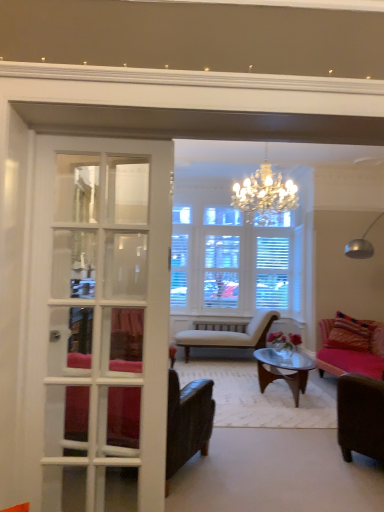
At what (x,y) coordinates should I click in order to perform the action: click on beige striped chaise lounge at center, which ranks as the first chair in back-to-front order. Please return your answer as a coordinate pair (x, y). The height and width of the screenshot is (512, 384). Looking at the image, I should click on (229, 335).

This screenshot has width=384, height=512. I want to click on leather armchair at left, the 3th chair viewed from the back, so click(x=187, y=421).

You are a GUI agent. You are given a task and a screenshot of the screen. Output one action in this format:
    pyautogui.click(x=<x>, y=<y>)
    Task: Click on the brown leather chair at lower right, which is counted as the second chair, starting from the back
    Image resolution: width=384 pixels, height=512 pixels.
    Given the screenshot: What is the action you would take?
    pyautogui.click(x=360, y=416)

What do you see at coordinates (101, 304) in the screenshot? I see `white glass door at left` at bounding box center [101, 304].

Locate an element on the screen. The width and height of the screenshot is (384, 512). beige striped chaise lounge at center, which ranks as the first chair in back-to-front order is located at coordinates (229, 335).

Can you see leather armchair at left, the 3th chair viewed from the back, touching beige striped chaise lounge at center, placed as the 3th chair when sorted from front to back?

There is a gap between leather armchair at left, the 3th chair viewed from the back, and beige striped chaise lounge at center, placed as the 3th chair when sorted from front to back.

Considering the positions of point (129, 440) and point (242, 343), is point (129, 440) closer or farther from the camera than point (242, 343)?

Point (129, 440) is positioned closer to the camera compared to point (242, 343).

How different are the orientations of leather armchair at left, the first chair in the front-to-back sequence, and beige striped chaise lounge at center, placed as the 3th chair when sorted from front to back, in degrees?

The facing directions of leather armchair at left, the first chair in the front-to-back sequence, and beige striped chaise lounge at center, placed as the 3th chair when sorted from front to back, are 152 degrees apart.

Based on the photo, do you think leather armchair at left, the 3th chair viewed from the back, is within beige striped chaise lounge at center, placed as the 3th chair when sorted from front to back, or outside of it?

leather armchair at left, the 3th chair viewed from the back, exists outside the volume of beige striped chaise lounge at center, placed as the 3th chair when sorted from front to back.

In the scene shown: From the image's perspective, is beige striped chaise lounge at center, placed as the 3th chair when sorted from front to back, located above leather armchair at left, the first chair in the front-to-back sequence?

No, from the image's perspective, beige striped chaise lounge at center, placed as the 3th chair when sorted from front to back, is not over leather armchair at left, the first chair in the front-to-back sequence.

Between point (200, 335) and point (183, 393), which one is positioned in front?

The point (183, 393) is closer.

Considering the relative positions of beige striped chaise lounge at center, placed as the 3th chair when sorted from front to back, and leather armchair at left, the first chair in the front-to-back sequence, in the image provided, is beige striped chaise lounge at center, placed as the 3th chair when sorted from front to back, behind leather armchair at left, the first chair in the front-to-back sequence,?

Yes, beige striped chaise lounge at center, placed as the 3th chair when sorted from front to back, is further from the viewer.

Looking at this image, does beige striped chaise lounge at center, which ranks as the first chair in back-to-front order, turn towards leather armchair at left, the 3th chair viewed from the back?

Yes, beige striped chaise lounge at center, which ranks as the first chair in back-to-front order, faces towards leather armchair at left, the 3th chair viewed from the back.

Which is in front, point (69, 362) or point (214, 335)?

The point (69, 362) is closer.

Which is more to the left, white glass door at left or beige striped chaise lounge at center, placed as the 3th chair when sorted from front to back?

From the viewer's perspective, white glass door at left appears more on the left side.

From a real-world perspective, relative to beige striped chaise lounge at center, which ranks as the first chair in back-to-front order, is white glass door at left vertically above or below?

white glass door at left is above beige striped chaise lounge at center, which ranks as the first chair in back-to-front order.

Can beige striped chaise lounge at center, placed as the 3th chair when sorted from front to back, be found inside white glass door at left?

That's incorrect, beige striped chaise lounge at center, placed as the 3th chair when sorted from front to back, is not inside white glass door at left.

Considering the relative positions of beige striped chaise lounge at center, placed as the 3th chair when sorted from front to back, and brown leather chair at lower right, marked as the second chair in a front-to-back arrangement, in the image provided, is beige striped chaise lounge at center, placed as the 3th chair when sorted from front to back, to the right of brown leather chair at lower right, marked as the second chair in a front-to-back arrangement, from the viewer's perspective?

In fact, beige striped chaise lounge at center, placed as the 3th chair when sorted from front to back, is to the left of brown leather chair at lower right, marked as the second chair in a front-to-back arrangement.

From the image's perspective, which object appears higher, beige striped chaise lounge at center, placed as the 3th chair when sorted from front to back, or brown leather chair at lower right, marked as the second chair in a front-to-back arrangement?

brown leather chair at lower right, marked as the second chair in a front-to-back arrangement, from the image's perspective.

Can you confirm if beige striped chaise lounge at center, which ranks as the first chair in back-to-front order, is smaller than brown leather chair at lower right, which is counted as the second chair, starting from the back?

No.

How many degrees apart are the facing directions of beige striped chaise lounge at center, which ranks as the first chair in back-to-front order, and brown leather chair at lower right, which is counted as the second chair, starting from the back?

179 degrees separate the facing orientations of beige striped chaise lounge at center, which ranks as the first chair in back-to-front order, and brown leather chair at lower right, which is counted as the second chair, starting from the back.

Consider the image. Considering the sizes of objects leather armchair at left, the first chair in the front-to-back sequence, and white glass door at left in the image provided, who is bigger, leather armchair at left, the first chair in the front-to-back sequence, or white glass door at left?

Bigger between the two is leather armchair at left, the first chair in the front-to-back sequence.

Can we say leather armchair at left, the 3th chair viewed from the back, lies outside white glass door at left?

Yes, leather armchair at left, the 3th chair viewed from the back, is not within white glass door at left.

Who is taller, leather armchair at left, the 3th chair viewed from the back, or white glass door at left?

Standing taller between the two is white glass door at left.

How far apart are brown leather chair at lower right, which is counted as the second chair, starting from the back, and white glass door at left?

The distance of brown leather chair at lower right, which is counted as the second chair, starting from the back, from white glass door at left is 5.86 feet.

You are a GUI agent. You are given a task and a screenshot of the screen. Output one action in this format:
    pyautogui.click(x=<x>, y=<y>)
    Task: Click on the 2nd chair to the right when counting from the white glass door at left
    
    Given the screenshot: What is the action you would take?
    click(360, 416)

Which object is further away from the camera taking this photo, brown leather chair at lower right, marked as the second chair in a front-to-back arrangement, or white glass door at left?

brown leather chair at lower right, marked as the second chair in a front-to-back arrangement, is further from the camera.

Which of these two, white glass door at left or leather armchair at left, the first chair in the front-to-back sequence, stands shorter?

leather armchair at left, the first chair in the front-to-back sequence.

Between point (83, 313) and point (75, 419), which one is positioned behind?

Positioned behind is point (83, 313).

Looking at this image, is white glass door at left directly adjacent to leather armchair at left, the 3th chair viewed from the back?

white glass door at left and leather armchair at left, the 3th chair viewed from the back, are clearly separated.

Can you confirm if white glass door at left is wider than leather armchair at left, the 3th chair viewed from the back?

Incorrect, the width of white glass door at left does not surpass that of leather armchair at left, the 3th chair viewed from the back.

Locate an element on the screen. the 1st chair to the right of the leather armchair at left, the 3th chair viewed from the back, starting your count from the anchor is located at coordinates (229, 335).

The image size is (384, 512). I want to click on chair that is the 2nd one when counting upward from the beige striped chaise lounge at center, which ranks as the first chair in back-to-front order (from the image's perspective), so click(187, 421).

Estimate the real-world distances between objects in this image. Which object is closer to white glass door at left, leather armchair at left, the first chair in the front-to-back sequence, or brown leather chair at lower right, marked as the second chair in a front-to-back arrangement?

Among the two, leather armchair at left, the first chair in the front-to-back sequence, is located nearer to white glass door at left.

Based on their spatial positions, is leather armchair at left, the 3th chair viewed from the back, or beige striped chaise lounge at center, placed as the 3th chair when sorted from front to back, closer to brown leather chair at lower right, which is counted as the second chair, starting from the back?

leather armchair at left, the 3th chair viewed from the back, lies closer to brown leather chair at lower right, which is counted as the second chair, starting from the back, than the other object.

Looking at the image, which one is located closer to leather armchair at left, the first chair in the front-to-back sequence, brown leather chair at lower right, marked as the second chair in a front-to-back arrangement, or beige striped chaise lounge at center, which ranks as the first chair in back-to-front order?

Among the two, brown leather chair at lower right, marked as the second chair in a front-to-back arrangement, is located nearer to leather armchair at left, the first chair in the front-to-back sequence.

In the scene shown: Looking at the image, which one is located closer to white glass door at left, beige striped chaise lounge at center, which ranks as the first chair in back-to-front order, or brown leather chair at lower right, which is counted as the second chair, starting from the back?

brown leather chair at lower right, which is counted as the second chair, starting from the back, is closer to white glass door at left.

From the image, which object appears to be farther from white glass door at left, beige striped chaise lounge at center, which ranks as the first chair in back-to-front order, or leather armchair at left, the first chair in the front-to-back sequence?

beige striped chaise lounge at center, which ranks as the first chair in back-to-front order, is positioned further to the anchor white glass door at left.

From the image, which object appears to be nearer to leather armchair at left, the first chair in the front-to-back sequence, beige striped chaise lounge at center, which ranks as the first chair in back-to-front order, or white glass door at left?

white glass door at left.

Based on their spatial positions, is white glass door at left or leather armchair at left, the first chair in the front-to-back sequence, closer to beige striped chaise lounge at center, which ranks as the first chair in back-to-front order?

Based on the image, leather armchair at left, the first chair in the front-to-back sequence, appears to be nearer to beige striped chaise lounge at center, which ranks as the first chair in back-to-front order.

Looking at the image, which one is located further to beige striped chaise lounge at center, which ranks as the first chair in back-to-front order, white glass door at left or brown leather chair at lower right, marked as the second chair in a front-to-back arrangement?

white glass door at left is further to beige striped chaise lounge at center, which ranks as the first chair in back-to-front order.

Identify the location of chair positioned between leather armchair at left, the first chair in the front-to-back sequence, and beige striped chaise lounge at center, placed as the 3th chair when sorted from front to back, from near to far. The image size is (384, 512). (360, 416).

Identify the location of door located between leather armchair at left, the first chair in the front-to-back sequence, and brown leather chair at lower right, marked as the second chair in a front-to-back arrangement, in the left-right direction. The height and width of the screenshot is (512, 384). (101, 304).